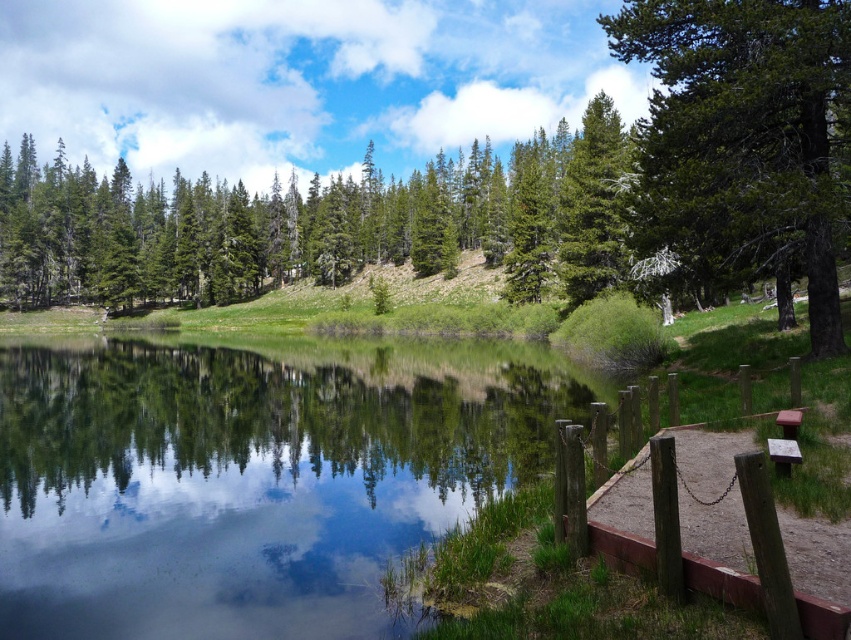
Which is more to the left, clear water at center or brown wooden bench at lower right?

clear water at center

Is point (277, 378) farther from viewer compared to point (786, 419)?

Yes, point (277, 378) is behind point (786, 419).

What are the coordinates of `clear water at center` in the screenshot? It's located at (252, 476).

This screenshot has height=640, width=851. Identify the location of clear water at center. (252, 476).

Consider the image. Does clear water at center appear over green matte tree at upper center?

Incorrect, clear water at center is not positioned above green matte tree at upper center.

Does clear water at center have a larger size compared to green matte tree at upper center?

Actually, clear water at center might be smaller than green matte tree at upper center.

The image size is (851, 640). Describe the element at coordinates (252, 476) in the screenshot. I see `clear water at center` at that location.

The width and height of the screenshot is (851, 640). Find the location of `clear water at center`. clear water at center is located at coordinates (252, 476).

Based on the photo, does green rough bark tree at upper right have a larger size compared to brown wooden picnic table at lower right?

Yes.

Is point (675, 122) positioned before point (781, 419)?

That is False.

The width and height of the screenshot is (851, 640). I want to click on green rough bark tree at upper right, so click(x=744, y=136).

Locate an element on the screen. This screenshot has height=640, width=851. green rough bark tree at upper right is located at coordinates (744, 136).